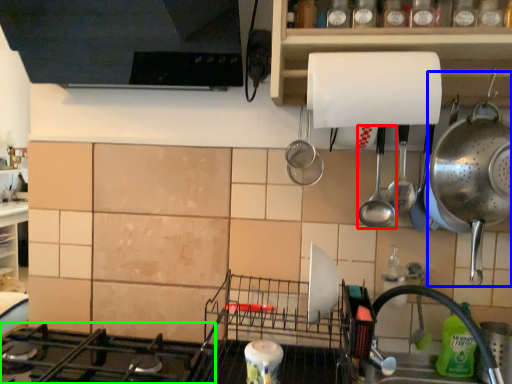
Question: Estimate the real-world distances between objects in this image. Which object is closer to spoon (highlighted by a red box), appliance (highlighted by a blue box) or gas stove (highlighted by a green box)?

Choices:
 (A) appliance
 (B) gas stove

Answer: (A)